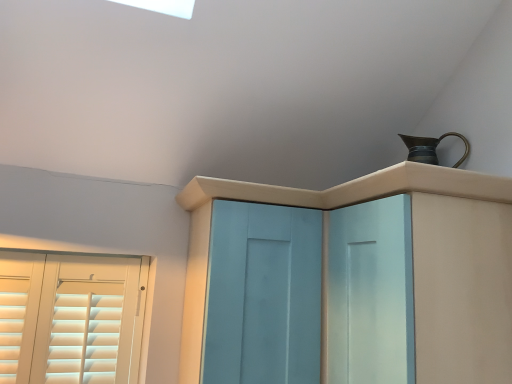
Question: Does light blue wood screen door at center come in front of light blue wood cupboard at upper center?

Choices:
 (A) yes
 (B) no

Answer: (B)

Question: Can you confirm if light blue wood screen door at center is positioned to the right of light blue wood cupboard at upper center?

Choices:
 (A) yes
 (B) no

Answer: (B)

Question: Is light blue wood screen door at center surrounding light blue wood cupboard at upper center?

Choices:
 (A) no
 (B) yes

Answer: (A)

Question: Considering the relative sizes of light blue wood screen door at center and light blue wood cupboard at upper center in the image provided, is light blue wood screen door at center smaller than light blue wood cupboard at upper center?

Choices:
 (A) yes
 (B) no

Answer: (A)

Question: Is light blue wood screen door at center not within light blue wood cupboard at upper center?

Choices:
 (A) no
 (B) yes

Answer: (A)

Question: Are light blue wood screen door at center and light blue wood cupboard at upper center beside each other?

Choices:
 (A) no
 (B) yes

Answer: (A)

Question: Can you confirm if bronze metallic jug at upper right is wider than light blue wood cupboard at upper center?

Choices:
 (A) yes
 (B) no

Answer: (B)

Question: From a real-world perspective, does bronze metallic jug at upper right sit lower than light blue wood cupboard at upper center?

Choices:
 (A) yes
 (B) no

Answer: (B)

Question: Is bronze metallic jug at upper right outside light blue wood cupboard at upper center?

Choices:
 (A) yes
 (B) no

Answer: (A)

Question: From a real-world perspective, is bronze metallic jug at upper right over light blue wood cupboard at upper center?

Choices:
 (A) yes
 (B) no

Answer: (A)

Question: Considering the relative sizes of bronze metallic jug at upper right and light blue wood cupboard at upper center in the image provided, is bronze metallic jug at upper right bigger than light blue wood cupboard at upper center?

Choices:
 (A) yes
 (B) no

Answer: (B)

Question: From the image's perspective, is bronze metallic jug at upper right located above light blue wood cupboard at upper center?

Choices:
 (A) no
 (B) yes

Answer: (B)

Question: Considering the relative sizes of light blue wood cupboard at upper center and bronze metallic jug at upper right in the image provided, is light blue wood cupboard at upper center wider than bronze metallic jug at upper right?

Choices:
 (A) no
 (B) yes

Answer: (B)